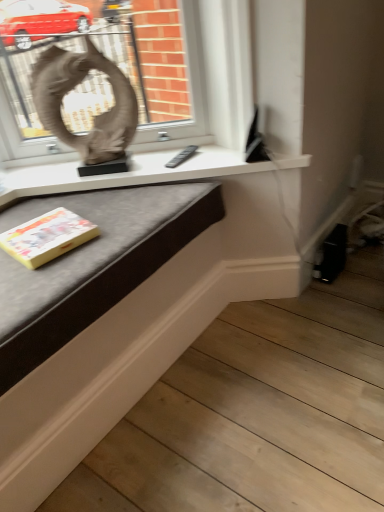
Question: Does matte gray sculpture at upper left appear on the right side of matte white table at center?

Choices:
 (A) yes
 (B) no

Answer: (B)

Question: Is matte gray sculpture at upper left positioned beyond the bounds of matte white table at center?

Choices:
 (A) no
 (B) yes

Answer: (B)

Question: Does matte gray sculpture at upper left have a greater width compared to matte white table at center?

Choices:
 (A) yes
 (B) no

Answer: (B)

Question: From a real-world perspective, is matte gray sculpture at upper left positioned over matte white table at center based on gravity?

Choices:
 (A) yes
 (B) no

Answer: (A)

Question: Is matte gray sculpture at upper left thinner than matte white table at center?

Choices:
 (A) no
 (B) yes

Answer: (B)

Question: Is matte gray sculpture at upper left beside matte white table at center?

Choices:
 (A) no
 (B) yes

Answer: (A)

Question: Does yellow paper at lower left have a greater height compared to matte gray sculpture at upper left?

Choices:
 (A) no
 (B) yes

Answer: (A)

Question: Is yellow paper at lower left directly adjacent to matte gray sculpture at upper left?

Choices:
 (A) yes
 (B) no

Answer: (B)

Question: Does yellow paper at lower left appear on the right side of matte gray sculpture at upper left?

Choices:
 (A) yes
 (B) no

Answer: (B)

Question: Is yellow paper at lower left oriented towards matte gray sculpture at upper left?

Choices:
 (A) yes
 (B) no

Answer: (B)

Question: From a real-world perspective, is yellow paper at lower left physically above matte gray sculpture at upper left?

Choices:
 (A) yes
 (B) no

Answer: (B)

Question: Is yellow paper at lower left further to the viewer compared to matte gray sculpture at upper left?

Choices:
 (A) no
 (B) yes

Answer: (A)

Question: Considering the relative sizes of matte white table at center and yellow paper at lower left in the image provided, is matte white table at center taller than yellow paper at lower left?

Choices:
 (A) yes
 (B) no

Answer: (A)